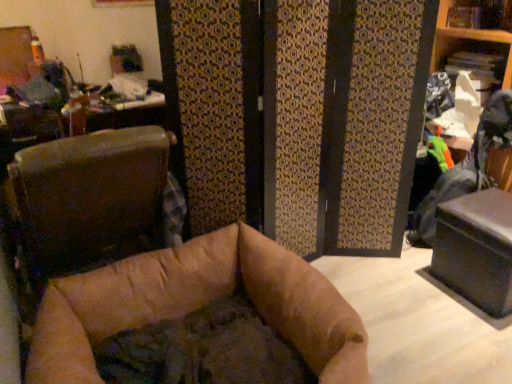
Question: Is brown leather chair at left positioned before black matte table at lower right?

Choices:
 (A) no
 (B) yes

Answer: (B)

Question: Can you confirm if brown leather chair at left is positioned to the right of black matte table at lower right?

Choices:
 (A) no
 (B) yes

Answer: (A)

Question: Considering the relative sizes of brown leather chair at left and black matte table at lower right in the image provided, is brown leather chair at left shorter than black matte table at lower right?

Choices:
 (A) yes
 (B) no

Answer: (B)

Question: Considering the relative sizes of brown leather chair at left and black matte table at lower right in the image provided, is brown leather chair at left taller than black matte table at lower right?

Choices:
 (A) yes
 (B) no

Answer: (A)

Question: Is brown leather chair at left further to the viewer compared to black matte table at lower right?

Choices:
 (A) no
 (B) yes

Answer: (A)

Question: From the image's perspective, is brown leather chair at left located above black matte table at lower right?

Choices:
 (A) yes
 (B) no

Answer: (A)

Question: Can you confirm if black matte table at lower right is shorter than brown leather chair at left?

Choices:
 (A) no
 (B) yes

Answer: (B)

Question: Is black matte table at lower right facing towards brown leather chair at left?

Choices:
 (A) yes
 (B) no

Answer: (B)

Question: Is the depth of black matte table at lower right greater than that of brown leather chair at left?

Choices:
 (A) no
 (B) yes

Answer: (B)

Question: Would you say black matte table at lower right contains brown leather chair at left?

Choices:
 (A) no
 (B) yes

Answer: (A)

Question: Is black matte table at lower right located outside brown leather chair at left?

Choices:
 (A) no
 (B) yes

Answer: (B)

Question: Considering the relative positions of black matte table at lower right and brown leather chair at left in the image provided, is black matte table at lower right to the left of brown leather chair at left from the viewer's perspective?

Choices:
 (A) no
 (B) yes

Answer: (A)

Question: Considering the positions of black matte table at lower right and brown leather chair at left in the image, is black matte table at lower right wider or thinner than brown leather chair at left?

Choices:
 (A) wide
 (B) thin

Answer: (A)